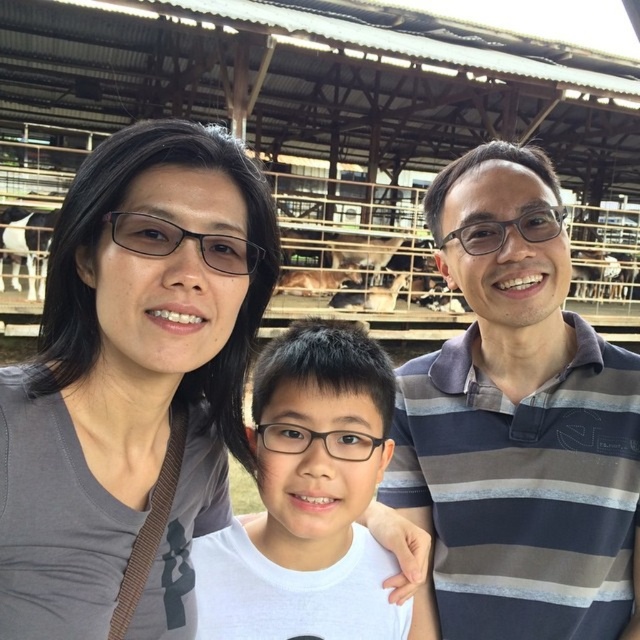
Does point (426, 202) come closer to viewer compared to point (256, 566)?

No, (426, 202) is further to viewer.

Locate an element on the screen. Image resolution: width=640 pixels, height=640 pixels. striped cotton polo shirt at right is located at coordinates (516, 426).

Find the location of a particular element. This screenshot has height=640, width=640. gray matte shirt at upper left is located at coordinates (132, 381).

You are a GUI agent. You are given a task and a screenshot of the screen. Output one action in this format:
    pyautogui.click(x=<x>, y=<y>)
    Task: Click on the gray matte shirt at upper left
    
    Given the screenshot: What is the action you would take?
    pyautogui.click(x=132, y=381)

Can you confirm if gray matte shirt at upper left is taller than striped cotton polo shirt at right?

Indeed, gray matte shirt at upper left has a greater height compared to striped cotton polo shirt at right.

Is point (132, 250) farther from camera compared to point (449, 372)?

No, it is not.

The height and width of the screenshot is (640, 640). What are the coordinates of `gray matte shirt at upper left` in the screenshot? It's located at (132, 381).